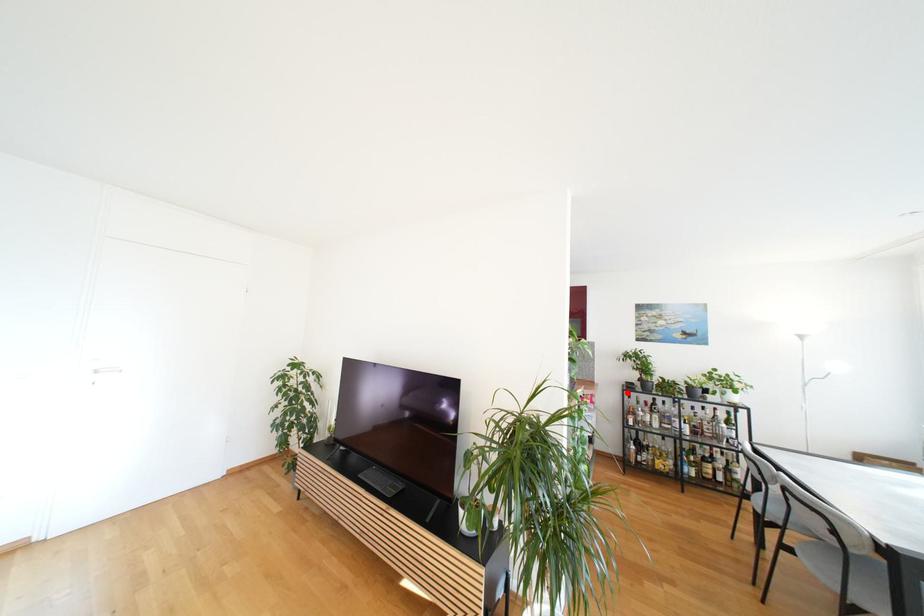
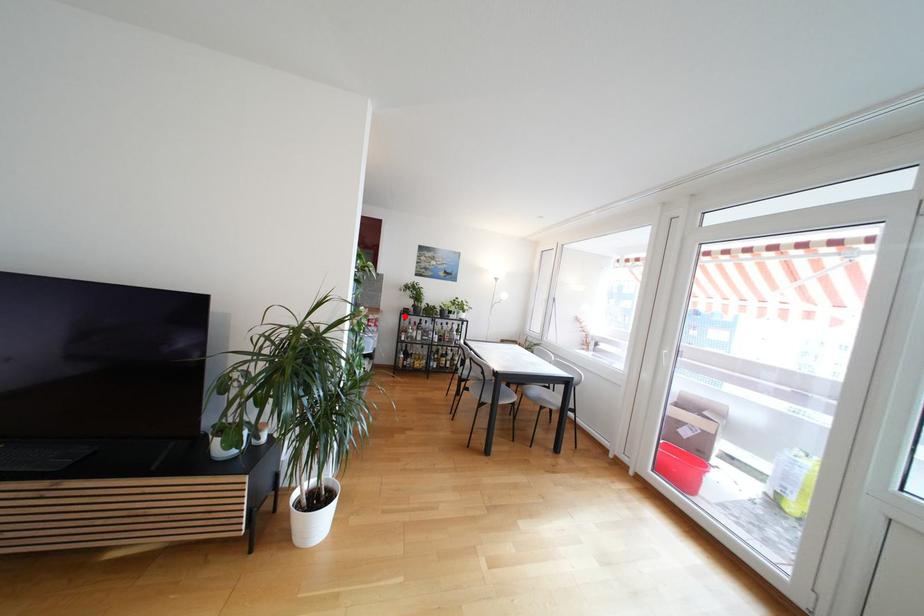
I am providing you with two images of the same scene from different viewpoints. A red point is marked on the first image and another point is marked on the second image. Is the marked point in image1 the same physical position as the marked point in image2?

Yes